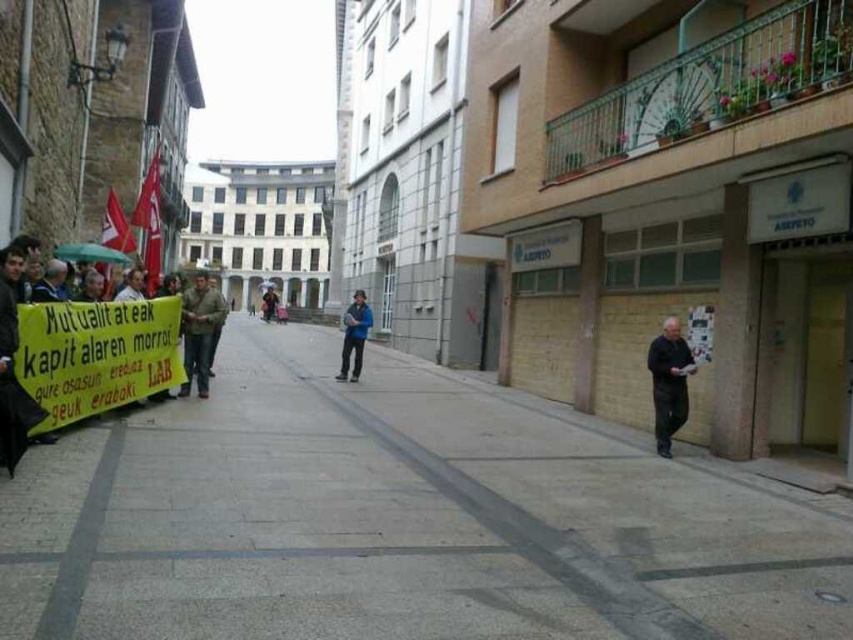
Question: Is black matte jacket at lower right thinner than blue fabric jacket at center?

Choices:
 (A) yes
 (B) no

Answer: (A)

Question: Can you confirm if gray concrete pavement at center is smaller than blue fabric jacket at center?

Choices:
 (A) no
 (B) yes

Answer: (A)

Question: Which point is closer to the camera taking this photo?

Choices:
 (A) (297, 618)
 (B) (683, 346)

Answer: (A)

Question: Which point appears farthest from the camera in this image?

Choices:
 (A) (344, 326)
 (B) (666, 403)
 (C) (149, 442)
 (D) (184, 346)

Answer: (A)

Question: Which object is the farthest from the blue fabric jacket at center?

Choices:
 (A) camouflage fabric jacket at center
 (B) black matte jacket at lower right

Answer: (A)

Question: Does camouflage fabric jacket at center lie behind blue fabric jacket at center?

Choices:
 (A) yes
 (B) no

Answer: (B)